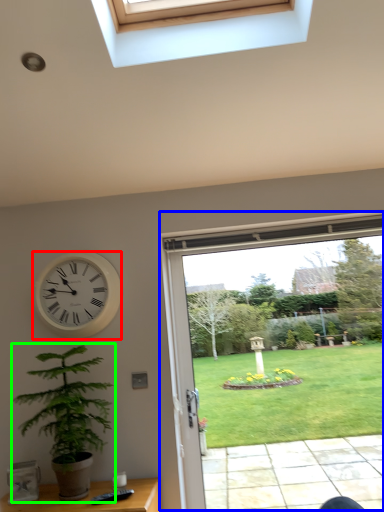
Question: Considering the real-world distances, which object is closest to wall clock (highlighted by a red box)? window (highlighted by a blue box) or houseplant (highlighted by a green box).

Choices:
 (A) window
 (B) houseplant

Answer: (B)